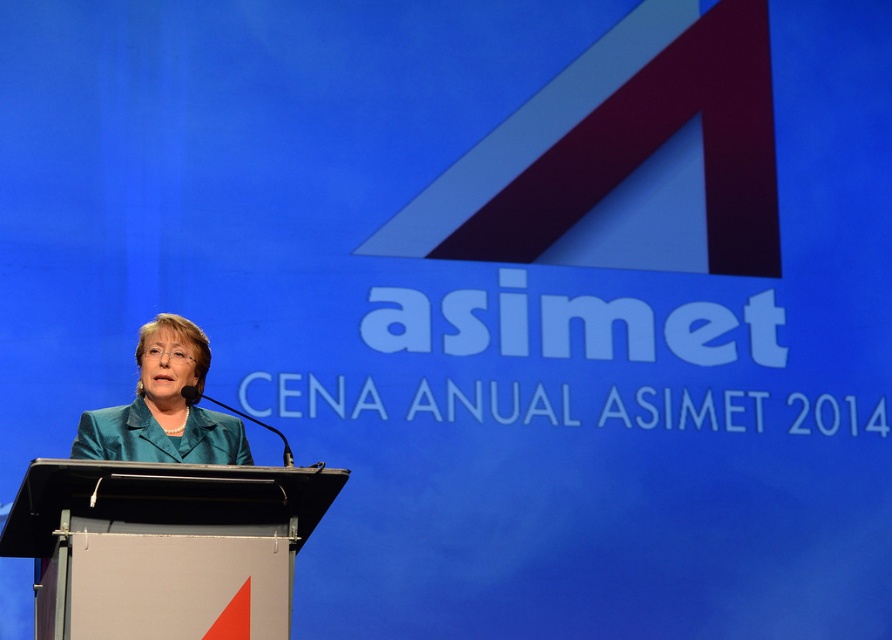
Question: Does metallic gray podium at center appear on the left side of teal fabric jacket at center?

Choices:
 (A) no
 (B) yes

Answer: (B)

Question: Which point is farther from the camera taking this photo?

Choices:
 (A) (112, 413)
 (B) (275, 515)

Answer: (A)

Question: Which point is closer to the camera?

Choices:
 (A) metallic gray podium at center
 (B) teal fabric jacket at center

Answer: (A)

Question: Is metallic gray podium at center further to camera compared to teal fabric jacket at center?

Choices:
 (A) no
 (B) yes

Answer: (A)

Question: Among these points, which one is nearest to the camera?

Choices:
 (A) (237, 449)
 (B) (63, 582)

Answer: (B)

Question: Can you confirm if metallic gray podium at center is positioned to the right of teal fabric jacket at center?

Choices:
 (A) yes
 (B) no

Answer: (B)